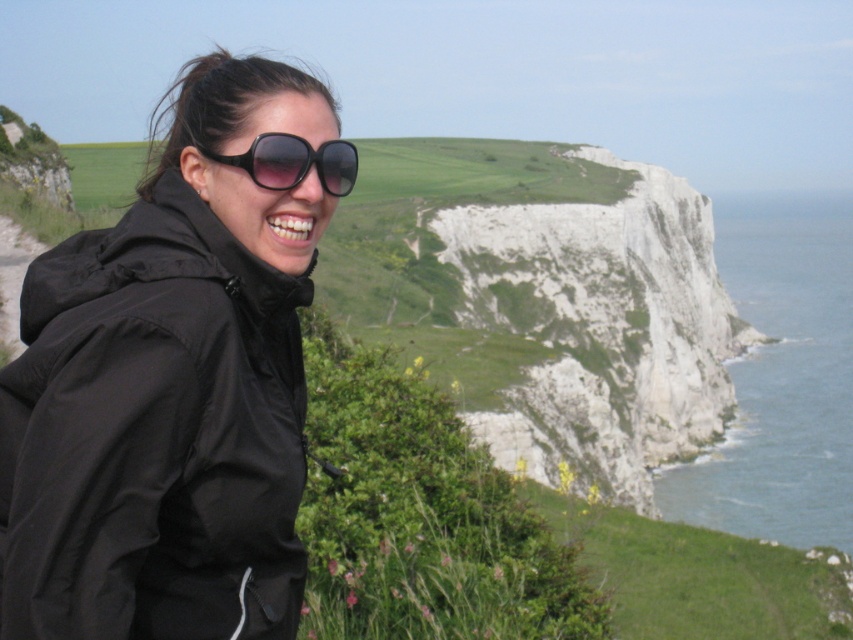
Question: Which point is farther from the camera taking this photo?

Choices:
 (A) (346, 179)
 (B) (190, 468)

Answer: (A)

Question: Among these points, which one is farthest from the camera?

Choices:
 (A) (335, 188)
 (B) (126, 241)

Answer: (A)

Question: Can you confirm if black matte jacket at left is positioned below black plastic sunglasses at upper center?

Choices:
 (A) no
 (B) yes

Answer: (B)

Question: In this image, where is black matte jacket at left located relative to black plastic sunglasses at upper center?

Choices:
 (A) left
 (B) right

Answer: (A)

Question: Is black matte jacket at left further to camera compared to black plastic sunglasses at upper center?

Choices:
 (A) yes
 (B) no

Answer: (B)

Question: Among these objects, which one is nearest to the camera?

Choices:
 (A) black matte jacket at left
 (B) black plastic sunglasses at upper center

Answer: (A)